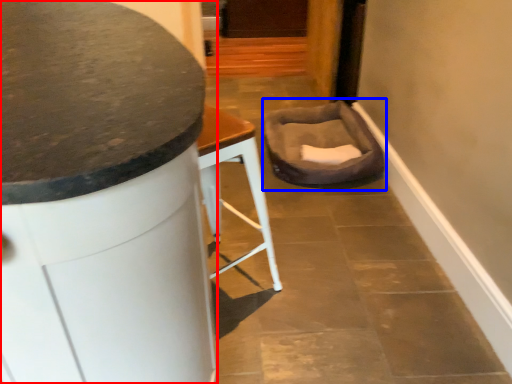
Question: Among these objects, which one is farthest to the camera, furniture (highlighted by a red box) or swivel chair (highlighted by a blue box)?

Choices:
 (A) furniture
 (B) swivel chair

Answer: (B)